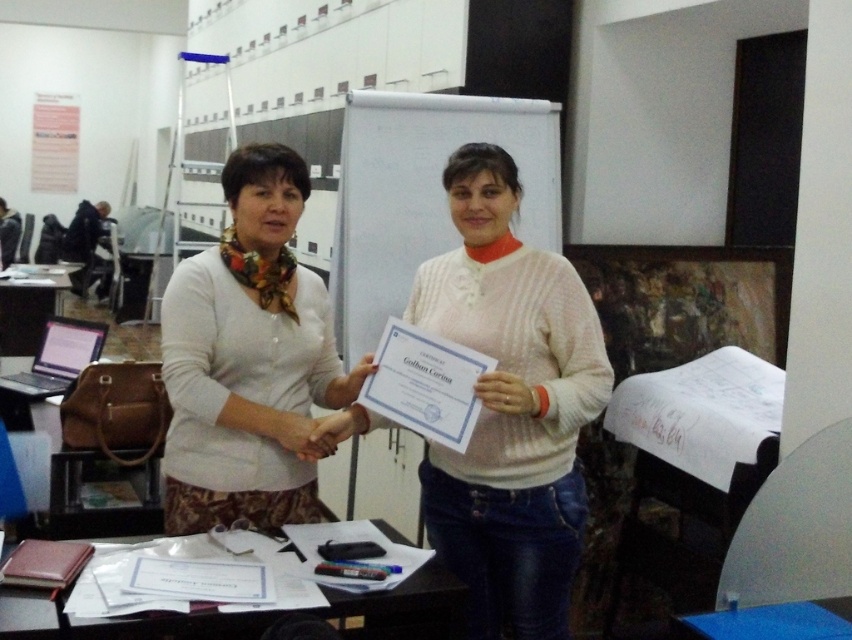
You are organizing a small event and need to place a decorative vase on the table. The vase is 15 cm tall. Can the blue plastic table at lower center support the white paper at lower center without it falling over?

The white paper at lower center is taller than the blue plastic table at lower center. Therefore, placing the white paper at lower center on the blue plastic table at lower center may cause it to be unstable or fall over since it exceeds the table height.

You are standing in the conference room and want to place a new poster between the two points labeled point (442, 627) and point (688, 634). Can you determine which point is closer to the front of the room?

Point (688, 634) is closer to the front of the room because it is in front of point (442, 627).

You are an event organizer and you need to arrange two certificates for a ceremony. The certificates are labeled as the white knitted sweater at center and the white matte sweater at center. Which certificate should be placed higher on the podium to match their sizes?

The white knitted sweater at center should be placed higher on the podium since it is much taller than the white matte sweater at center.